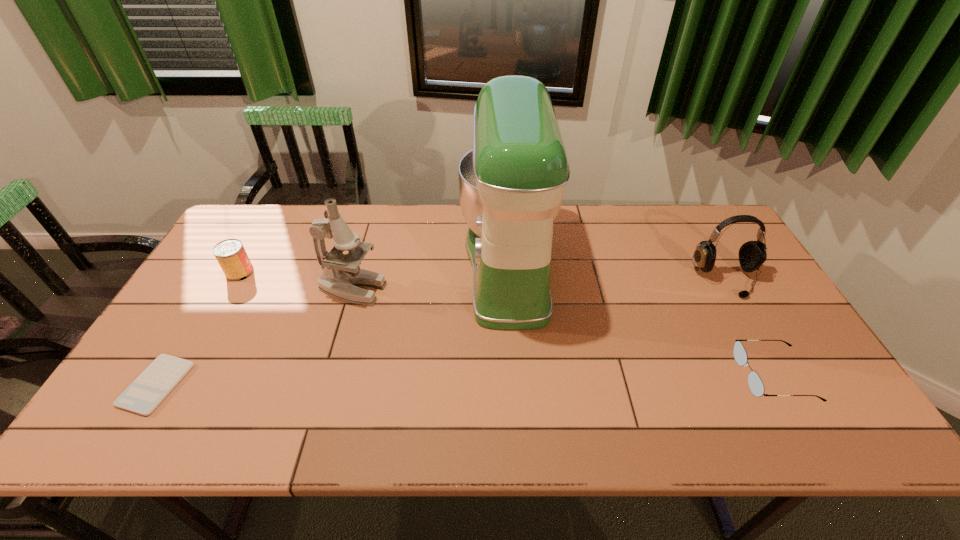
Locate an element on the screen. free space between the fourth object from left to right and the calculator is located at coordinates (333, 326).

Find the location of a particular element. The image size is (960, 540). vacant point located between the shortest object and the fourth object from right to left is located at coordinates click(254, 337).

At what (x,y) coordinates should I click in order to perform the action: click on blank region between the fourth object from left to right and the can. Please return your answer as a coordinate pair (x, y). Looking at the image, I should click on (374, 269).

At what (x,y) coordinates should I click in order to perform the action: click on blank region between the tallest object and the third object from left to right. Please return your answer as a coordinate pair (x, y). The image size is (960, 540). Looking at the image, I should click on (431, 278).

The image size is (960, 540). Identify the location of empty space between the fourth tallest object and the calculator. (199, 328).

Identify the location of the closest object relative to the spectacles. (752, 254).

Locate which object is the closest to the calculator. Please provide its 2D coordinates. Your answer should be formatted as a tuple, i.e. [(x, y)], where the tuple contains the x and y coordinates of a point satisfying the conditions above.

[(230, 254)]

I want to click on free space that satisfies the following two spatial constraints: 1. on the back side of the third shortest object; 2. on the left side of the calculator, so click(x=225, y=272).